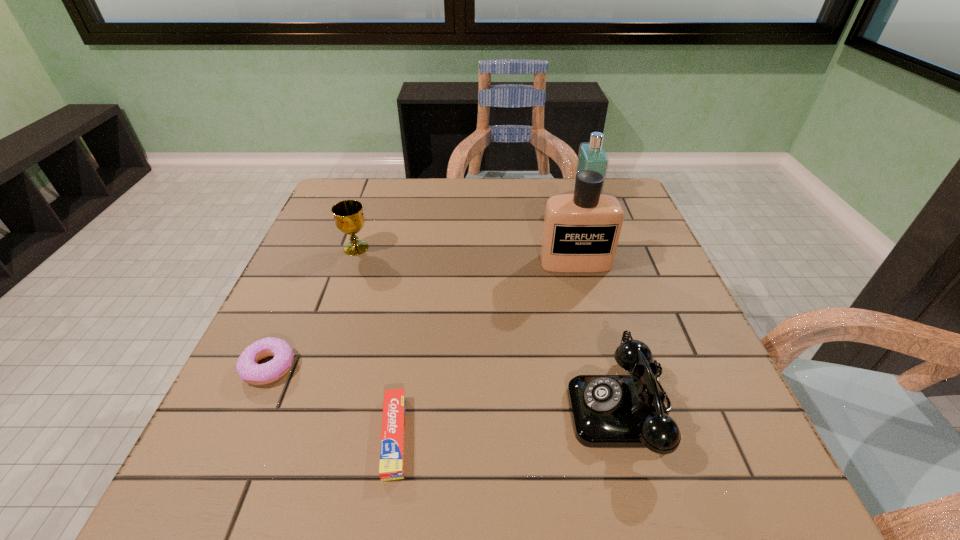
This screenshot has width=960, height=540. I want to click on vacant space located on the front label of the second tallest object, so click(478, 197).

Where is `vacant region located 0.230m on the front label of the second tallest object`? vacant region located 0.230m on the front label of the second tallest object is located at coordinates (498, 197).

Image resolution: width=960 pixels, height=540 pixels. I want to click on vacant space located on the front label of the second tallest object, so click(541, 197).

You are a GUI agent. You are given a task and a screenshot of the screen. Output one action in this format:
    pyautogui.click(x=<x>, y=<y>)
    Task: Click on the vacant space located on the right of the chalice
    Image resolution: width=960 pixels, height=540 pixels.
    Given the screenshot: What is the action you would take?
    pyautogui.click(x=449, y=248)

Find the location of a particular element. Image resolution: width=960 pixels, height=540 pixels. vacant space located on the dial of the telephone is located at coordinates (508, 408).

Locate an element on the screen. free space located 0.140m on the dial of the telephone is located at coordinates (491, 408).

In order to click on free point located 0.120m on the dial of the telephone in this screenshot , I will do `click(502, 408)`.

This screenshot has width=960, height=540. What are the coordinates of `blank area located 0.160m on the front of the doughnut` in the screenshot? It's located at (221, 475).

The width and height of the screenshot is (960, 540). I want to click on vacant space positioned on the right of the shortest object, so click(516, 436).

Where is `object situated at the far edge`? The width and height of the screenshot is (960, 540). object situated at the far edge is located at coordinates (592, 156).